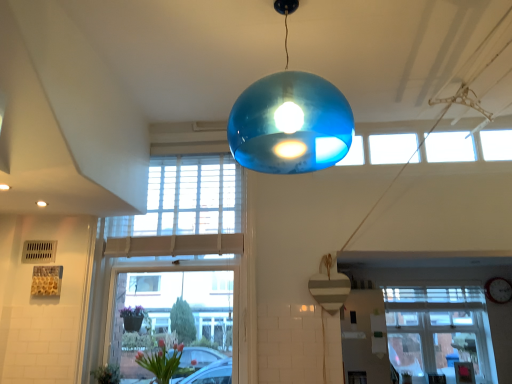
Identify the location of transparent glass window at lower right, the second window viewed from the top. This screenshot has height=384, width=512. (439, 331).

The height and width of the screenshot is (384, 512). In order to click on pink glass vase at lower left in this screenshot , I will do `click(161, 362)`.

This screenshot has width=512, height=384. What do you see at coordinates (161, 362) in the screenshot?
I see `pink glass vase at lower left` at bounding box center [161, 362].

Describe the element at coordinates (498, 290) in the screenshot. I see `matte white clock at center` at that location.

At what (x,y) coordinates should I click in order to perform the action: click on wooden heart at center. Please return your answer as a coordinate pair (x, y). This screenshot has height=384, width=512. Looking at the image, I should click on (329, 291).

The width and height of the screenshot is (512, 384). Identify the location of white matte exhaust hood at upper left. (66, 120).

I want to click on clear glass window at center, which is the 1th window from left to right, so click(192, 300).

Is clear glass window at center, which is the 1th window from left to right, positioned before wooden heart at center?

No, clear glass window at center, which is the 1th window from left to right, is behind wooden heart at center.

Are clear glass window at center, the second window positioned from the bottom, and wooden heart at center far apart?

No, clear glass window at center, the second window positioned from the bottom, is not far away from wooden heart at center.

From a real-world perspective, is clear glass window at center, marked as the 2th window in a back-to-front arrangement, physically located above or below wooden heart at center?

clear glass window at center, marked as the 2th window in a back-to-front arrangement, is above wooden heart at center.

Would you say wooden heart at center is a long distance from clear glass window at center, marked as the 2th window in a back-to-front arrangement?

No, there isn't a large distance between wooden heart at center and clear glass window at center, marked as the 2th window in a back-to-front arrangement.

From the image's perspective, is wooden heart at center located above clear glass window at center, which is the 1th window from left to right?

Actually, wooden heart at center appears below clear glass window at center, which is the 1th window from left to right, in the image.

In order to click on window positioned vertically above the wooden heart at center (from a real-world perspective) in this screenshot , I will do `click(192, 300)`.

How many degrees apart are the facing directions of wooden heart at center and clear glass window at center, the 2th window when ordered from right to left?

1.86 degrees.

Is white matte exhaust hood at upper left positioned far away from matte white clock at center?

Yes, white matte exhaust hood at upper left and matte white clock at center are quite far apart.

Can you confirm if white matte exhaust hood at upper left is shorter than matte white clock at center?

Indeed, white matte exhaust hood at upper left has a lesser height compared to matte white clock at center.

Considering the relative sizes of white matte exhaust hood at upper left and matte white clock at center in the image provided, is white matte exhaust hood at upper left smaller than matte white clock at center?

No, white matte exhaust hood at upper left is not smaller than matte white clock at center.

Considering the points (16, 30) and (508, 287), which point is behind, point (16, 30) or point (508, 287)?

The point (508, 287) is farther from the camera.

Which is less distant, [487,296] or [319,279]?

Point [487,296].

How many degrees apart are the facing directions of matte white clock at center and wooden heart at center?

The facing directions of matte white clock at center and wooden heart at center are 1.82 degrees apart.

Considering the relative positions of matte white clock at center and wooden heart at center in the image provided, is matte white clock at center to the right of wooden heart at center from the viewer's perspective?

Yes.

Which object is closer to the camera, matte white clock at center or wooden heart at center?

wooden heart at center.

Does clear glass window at center, the 2th window when ordered from right to left, contain pink glass vase at lower left?

Yes, clear glass window at center, the 2th window when ordered from right to left, contains pink glass vase at lower left.

I want to click on window that is the 1st one when counting backward from the pink glass vase at lower left, so click(x=192, y=300).

Would you consider clear glass window at center, which is the 1th window from left to right, to be distant from pink glass vase at lower left?

They are positioned close to each other.

Is the depth of clear glass window at center, marked as the 2th window in a back-to-front arrangement, less than that of pink glass vase at lower left?

No.

Is matte white clock at center in contact with transparent glass window at lower right, arranged as the first window when viewed from the right?

No.

From the image's perspective, is matte white clock at center beneath transparent glass window at lower right, acting as the second window starting from the left?

No.

Consider the image. From a real-world perspective, is matte white clock at center located higher than transparent glass window at lower right, the 1th window ordered from the bottom?

Yes, from a real-world perspective, matte white clock at center is on top of transparent glass window at lower right, the 1th window ordered from the bottom.

Would you say matte white clock at center is to the left or to the right of transparent glass window at lower right, the 1th window ordered from the bottom, in the picture?

matte white clock at center is positioned on transparent glass window at lower right, the 1th window ordered from the bottom,'s right side.

Considering the relative sizes of white matte exhaust hood at upper left and clear glass window at center, which is the first window in front-to-back order, in the image provided, is white matte exhaust hood at upper left smaller than clear glass window at center, which is the first window in front-to-back order,?

Yes, white matte exhaust hood at upper left is smaller than clear glass window at center, which is the first window in front-to-back order.

Does white matte exhaust hood at upper left have a greater height compared to clear glass window at center, which is the first window in front-to-back order?

Incorrect, the height of white matte exhaust hood at upper left is not larger of that of clear glass window at center, which is the first window in front-to-back order.

Looking at this image, from the image's perspective, which is below, white matte exhaust hood at upper left or clear glass window at center, the second window positioned from the bottom?

clear glass window at center, the second window positioned from the bottom, appears lower in the image.

Based on the photo, how many degrees apart are the facing directions of white matte exhaust hood at upper left and clear glass window at center, which is the first window in front-to-back order?

89.1 degrees separate the facing orientations of white matte exhaust hood at upper left and clear glass window at center, which is the first window in front-to-back order.

Locate an element on the screen. The height and width of the screenshot is (384, 512). lampshade that appears below the clear glass window at center, which is the 1th window from left to right (from a real-world perspective) is located at coordinates (329, 291).

Where is `lampshade that is below the clear glass window at center, the first window when ordered from top to bottom (from the image's perspective)`? The image size is (512, 384). lampshade that is below the clear glass window at center, the first window when ordered from top to bottom (from the image's perspective) is located at coordinates (329, 291).

Estimate the real-world distances between objects in this image. Which object is closer to transparent glass window at lower right, the 1th window ordered from the bottom, white matte exhaust hood at upper left or wooden heart at center?

wooden heart at center is closer to transparent glass window at lower right, the 1th window ordered from the bottom.

Which object lies further to the anchor point matte white clock at center, pink glass vase at lower left or white matte exhaust hood at upper left?

white matte exhaust hood at upper left lies further to matte white clock at center than the other object.

Estimate the real-world distances between objects in this image. Which object is further from wooden heart at center, matte white clock at center or clear glass window at center, the 2th window when ordered from right to left?

matte white clock at center.

Considering their positions, is pink glass vase at lower left positioned further to clear glass window at center, marked as the 2th window in a back-to-front arrangement, than transparent glass window at lower right, which is counted as the first window, starting from the back?

transparent glass window at lower right, which is counted as the first window, starting from the back, is further to clear glass window at center, marked as the 2th window in a back-to-front arrangement.

From the image, which object appears to be farther from wooden heart at center, transparent glass window at lower right, acting as the second window starting from the left, or white matte exhaust hood at upper left?

A: The object further to wooden heart at center is transparent glass window at lower right, acting as the second window starting from the left.

From the image, which object appears to be farther from matte white clock at center, pink glass vase at lower left or clear glass window at center, the second window positioned from the bottom?

The object further to matte white clock at center is pink glass vase at lower left.

When comparing their distances from transparent glass window at lower right, which is counted as the first window, starting from the back, does pink glass vase at lower left or wooden heart at center seem further?

pink glass vase at lower left lies further to transparent glass window at lower right, which is counted as the first window, starting from the back, than the other object.

Estimate the real-world distances between objects in this image. Which object is closer to wooden heart at center, pink glass vase at lower left or matte white clock at center?

Among the two, pink glass vase at lower left is located nearer to wooden heart at center.

This screenshot has width=512, height=384. Find the location of `floral arrangement situated between white matte exhaust hood at upper left and transparent glass window at lower right, the second window viewed from the top, from left to right`. floral arrangement situated between white matte exhaust hood at upper left and transparent glass window at lower right, the second window viewed from the top, from left to right is located at coordinates (161, 362).

Where is `floral arrangement between clear glass window at center, the 2th window when ordered from right to left, and wooden heart at center`? This screenshot has height=384, width=512. floral arrangement between clear glass window at center, the 2th window when ordered from right to left, and wooden heart at center is located at coordinates (161, 362).

Image resolution: width=512 pixels, height=384 pixels. I want to click on floral arrangement between clear glass window at center, which is the first window in front-to-back order, and transparent glass window at lower right, the 1th window ordered from the bottom, so click(161, 362).

Locate an element on the screen. The height and width of the screenshot is (384, 512). floral arrangement between white matte exhaust hood at upper left and wooden heart at center in the horizontal direction is located at coordinates (161, 362).